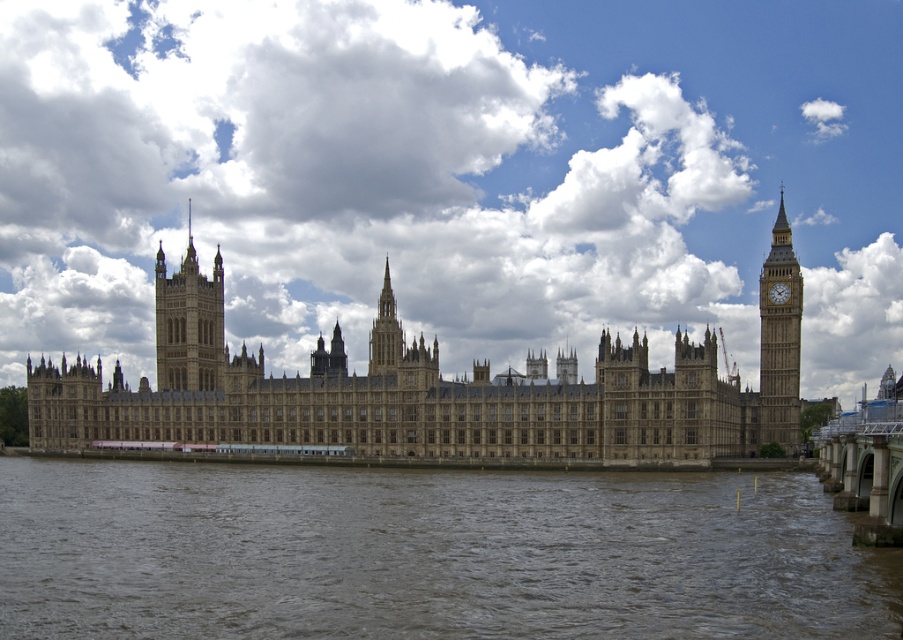
Is point (880, 403) behind point (771, 292)?

No.

This screenshot has width=903, height=640. I want to click on metallic gray bridge at lower right, so click(x=866, y=468).

This screenshot has height=640, width=903. What are the coordinates of `metallic gray bridge at lower right` in the screenshot? It's located at click(866, 468).

At what (x,y) coordinates should I click in order to perform the action: click on metallic gray bridge at lower right. Please return your answer as a coordinate pair (x, y). Looking at the image, I should click on (866, 468).

Can you confirm if brown water at lower left is thinner than golden stone tower at left?

Incorrect, brown water at lower left's width is not less than golden stone tower at left's.

Can you confirm if brown water at lower left is positioned above golden stone tower at left?

Actually, brown water at lower left is below golden stone tower at left.

What do you see at coordinates (427, 554) in the screenshot?
I see `brown water at lower left` at bounding box center [427, 554].

Locate an element on the screen. brown water at lower left is located at coordinates (427, 554).

Does white fluffy cloud at upper center appear over metallic gray bridge at lower right?

Correct, white fluffy cloud at upper center is located above metallic gray bridge at lower right.

Does point (380, 100) lie behind point (861, 502)?

Yes, point (380, 100) is behind point (861, 502).

What are the coordinates of `white fluffy cloud at upper center` in the screenshot? It's located at (377, 106).